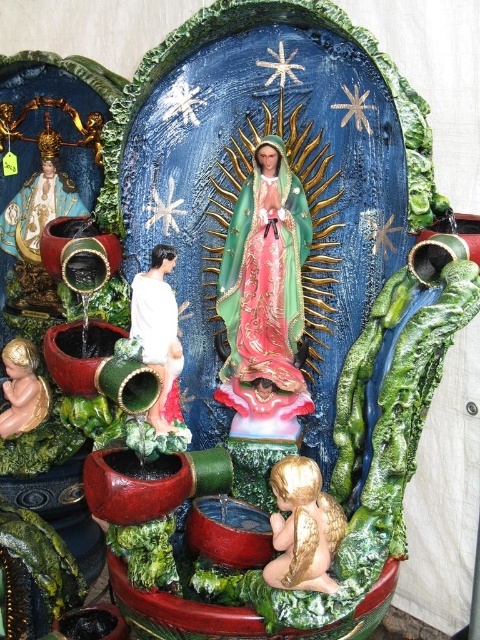
Measure the distance from gold metallic angel at lower center to white matte statue at center-left.

9.90 inches

Does gold metallic angel at lower center have a smaller size compared to white matte statue at center-left?

Yes, gold metallic angel at lower center is smaller than white matte statue at center-left.

What do you see at coordinates (302, 528) in the screenshot? The width and height of the screenshot is (480, 640). I see `gold metallic angel at lower center` at bounding box center [302, 528].

Image resolution: width=480 pixels, height=640 pixels. In order to click on gold metallic angel at lower center in this screenshot , I will do `click(302, 528)`.

Does gold metallic angel at lower center have a larger size compared to gold painted wood baby at lower left?

Yes, gold metallic angel at lower center is bigger than gold painted wood baby at lower left.

Between gold metallic angel at lower center and gold painted wood baby at lower left, which one appears on the right side from the viewer's perspective?

gold metallic angel at lower center

Does point (290, 513) come farther from viewer compared to point (23, 428)?

No, (290, 513) is in front of (23, 428).

Where is `gold metallic angel at lower center`? The width and height of the screenshot is (480, 640). gold metallic angel at lower center is located at coordinates tap(302, 528).

Between matte green fabric statue at center and white matte statue at center-left, which one is positioned higher?

Positioned higher is matte green fabric statue at center.

What do you see at coordinates (264, 273) in the screenshot?
I see `matte green fabric statue at center` at bounding box center [264, 273].

You are a GUI agent. You are given a task and a screenshot of the screen. Output one action in this format:
    pyautogui.click(x=<x>, y=<y>)
    Task: Click on the matte green fabric statue at center
    Image resolution: width=480 pixels, height=640 pixels.
    Given the screenshot: What is the action you would take?
    pyautogui.click(x=264, y=273)